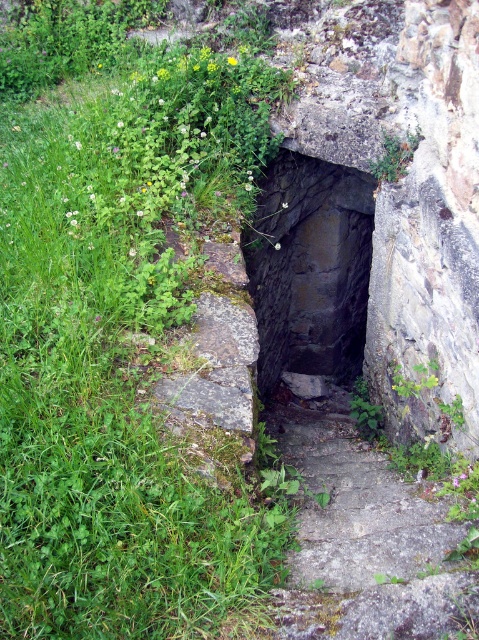
Question: Observing the image, what is the correct spatial positioning of gray stone steps at center in reference to dark stone staircase at center?

Choices:
 (A) left
 (B) right

Answer: (A)

Question: Which object is positioned farthest from the green leafy grass at left?

Choices:
 (A) gray stone steps at center
 (B) dark stone staircase at center

Answer: (B)

Question: Can you confirm if green leafy grass at left is positioned to the right of gray stone steps at center?

Choices:
 (A) yes
 (B) no

Answer: (B)

Question: Which point is closer to the camera?

Choices:
 (A) green leafy grass at left
 (B) gray stone steps at center

Answer: (A)

Question: Which of these objects is positioned closest to the green leafy grass at left?

Choices:
 (A) gray stone steps at center
 (B) dark stone staircase at center

Answer: (A)

Question: Does green leafy grass at left appear over dark stone staircase at center?

Choices:
 (A) no
 (B) yes

Answer: (B)